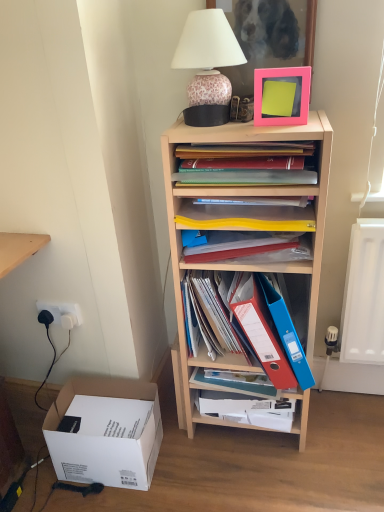
Find the location of a particular element. The image size is (384, 512). free space to the right of white cardboard box at lower left is located at coordinates (198, 464).